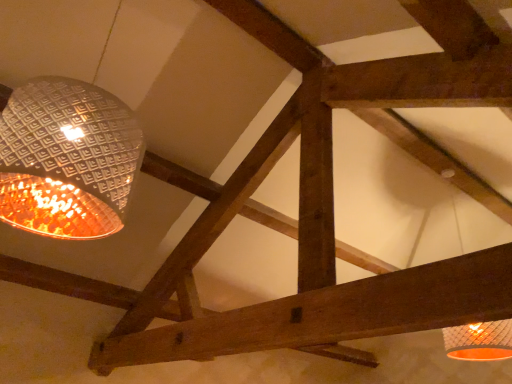
Locate an element on the screen. The image size is (512, 384). metallic textured lampshade at upper left is located at coordinates (67, 159).

This screenshot has width=512, height=384. What do you see at coordinates (67, 159) in the screenshot?
I see `metallic textured lampshade at upper left` at bounding box center [67, 159].

Find the location of `metallic textured lampshade at upper left`. metallic textured lampshade at upper left is located at coordinates (67, 159).